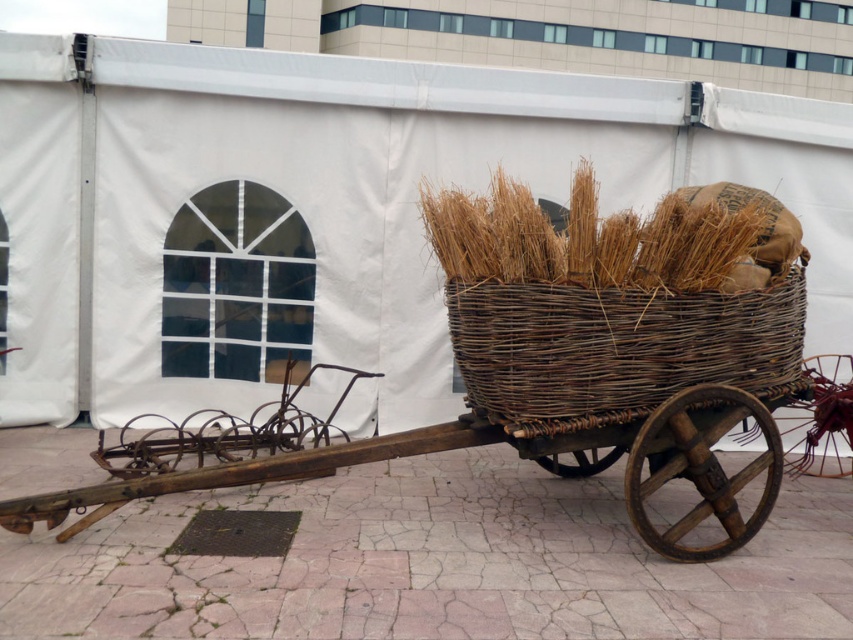
Question: Which of the following is the closest to the observer?

Choices:
 (A) (531, 392)
 (B) (814, 392)

Answer: (A)

Question: Which of the following is the farthest from the observer?

Choices:
 (A) (695, 513)
 (B) (459, 358)

Answer: (B)

Question: Is woven brown basket at center positioned in front of woven wood cart at center?

Choices:
 (A) no
 (B) yes

Answer: (A)

Question: Can you confirm if woven brown basket at center is positioned to the left of woven wood cart at center?

Choices:
 (A) no
 (B) yes

Answer: (A)

Question: Does woven brown basket at center appear on the left side of woven wood cart at center?

Choices:
 (A) yes
 (B) no

Answer: (B)